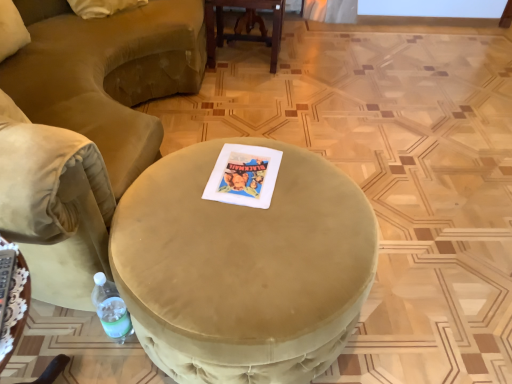
Question: From the image's perspective, is satin beige ottoman at center, marked as the second table in a back-to-front arrangement, above or below wooden table at center, the second table ordered from the bottom?

Choices:
 (A) above
 (B) below

Answer: (B)

Question: Is satin beige ottoman at center, which is the 1th table from bottom to top, wider or thinner than wooden table at center, the 1th table in the top-to-bottom sequence?

Choices:
 (A) wide
 (B) thin

Answer: (B)

Question: Estimate the real-world distances between objects in this image. Which object is farther from the velvet beige chair at lower left?

Choices:
 (A) wooden table at center, which is the 1th table in back-to-front order
 (B) satin beige ottoman at center, arranged as the first table when viewed from the left
 (C) suede-like beige ottoman at center
 (D) translucent plastic bottle at lower left

Answer: (A)

Question: Which is nearer to the suede-like beige ottoman at center?

Choices:
 (A) wooden table at center, which is the 1th table in back-to-front order
 (B) velvet beige chair at lower left
 (C) translucent plastic bottle at lower left
 (D) satin beige ottoman at center, which is the 1th table from bottom to top

Answer: (C)